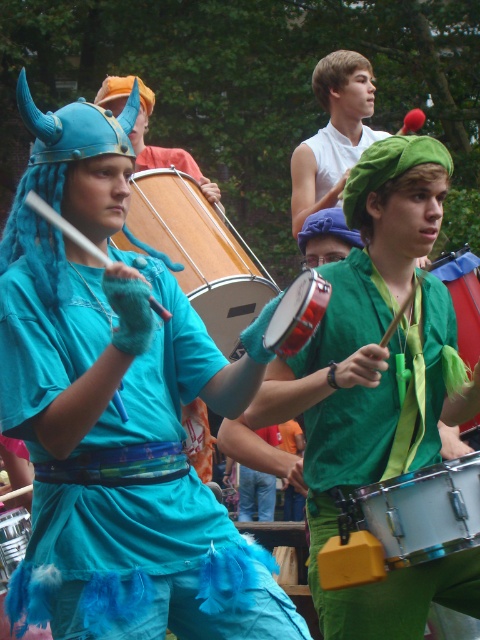
Question: Considering the relative positions of green matte drum at center and shiny red drum at center in the image provided, where is green matte drum at center located with respect to shiny red drum at center?

Choices:
 (A) below
 (B) above

Answer: (A)

Question: Can you confirm if green matte drum at center is positioned to the right of shiny red drum at center?

Choices:
 (A) yes
 (B) no

Answer: (A)

Question: Estimate the real-world distances between objects in this image. Which object is closer to the white smooth shirt at upper center?

Choices:
 (A) matte blue fabric at center
 (B) wooden drum at center
 (C) shiny red drum at center
 (D) shiny silver drum at center

Answer: (B)

Question: Which of the following is the farthest from the observer?

Choices:
 (A) white smooth shirt at upper center
 (B) metallic silver drum at lower right
 (C) brushed metal drum at lower left
 (D) wooden drum at center

Answer: (A)

Question: Does shiny red drum at center appear over brushed metal drum at lower left?

Choices:
 (A) no
 (B) yes

Answer: (B)

Question: Which object is positioned closest to the green matte drum at center?

Choices:
 (A) white smooth shirt at upper center
 (B) shiny silver drum at center

Answer: (B)